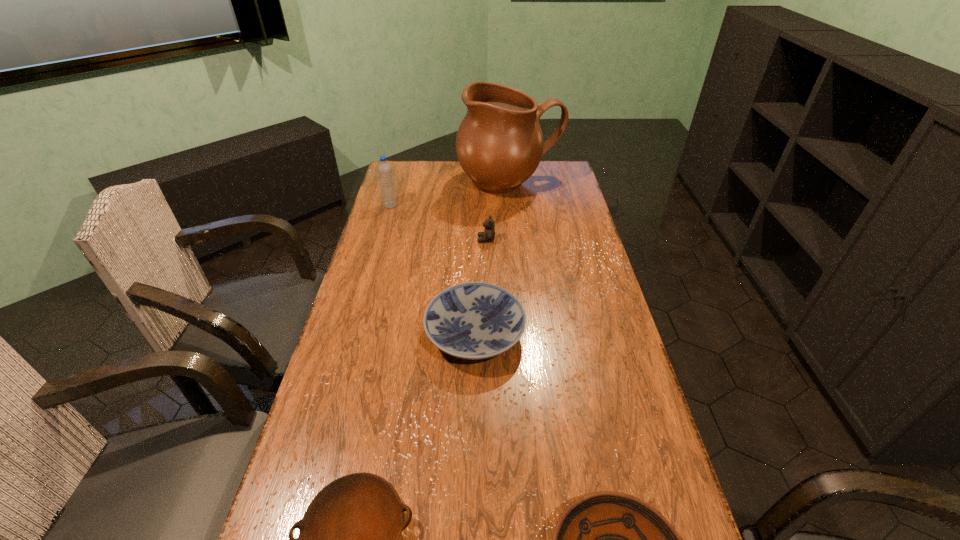
Where is `free spot between the fifth shortest object and the cream pitcher`? free spot between the fifth shortest object and the cream pitcher is located at coordinates (450, 194).

Find the location of a particular element. The image size is (960, 540). vacant area that lies between the fourth farthest object and the tallest object is located at coordinates (492, 259).

Where is `vacant space that's between the second tallest object and the tallest object`? This screenshot has width=960, height=540. vacant space that's between the second tallest object and the tallest object is located at coordinates 450,194.

Identify which object is the third nearest to the farthest plate. Please provide its 2D coordinates. Your answer should be formatted as a tuple, i.e. [(x, y)], where the tuple contains the x and y coordinates of a point satisfying the conditions above.

[(606, 539)]

Locate an element on the screen. Image resolution: width=960 pixels, height=540 pixels. object that is the fourth closest to the cream pitcher is located at coordinates (348, 539).

Select which plate is the closest to the cream pitcher. Please provide its 2D coordinates. Your answer should be formatted as a tuple, i.e. [(x, y)], where the tuple contains the x and y coordinates of a point satisfying the conditions above.

[(475, 320)]

Image resolution: width=960 pixels, height=540 pixels. Identify the location of plate that is the second closest one to the fourth shortest object. (348, 539).

Locate an element on the screen. The width and height of the screenshot is (960, 540). vacant space that satisfies the following two spatial constraints: 1. at the spout of the cream pitcher; 2. on the face of the third farthest object is located at coordinates (516, 240).

Where is `free space that satisfies the following two spatial constraints: 1. at the spout of the cream pitcher; 2. on the face of the teddy bear`? free space that satisfies the following two spatial constraints: 1. at the spout of the cream pitcher; 2. on the face of the teddy bear is located at coordinates (516, 240).